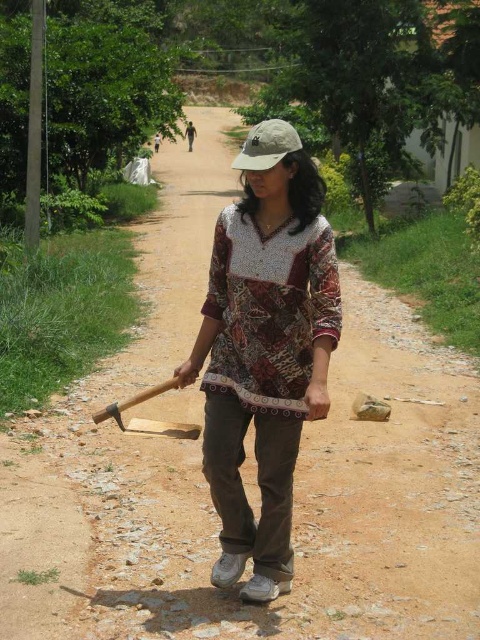
You are a photographer trying to capture the woman in the scene. You notice the batik fabric shirt at center and the khaki fabric baseball cap at center. Which clothing item is lower in position relative to the other?

The batik fabric shirt at center is shorter than the khaki fabric baseball cap at center, so the batik fabric shirt at center is lower in position.

Based on the scene description, where is the batik fabric shirt at center located in the image?

The batik fabric shirt at center is located at point (264, 358) in the image.